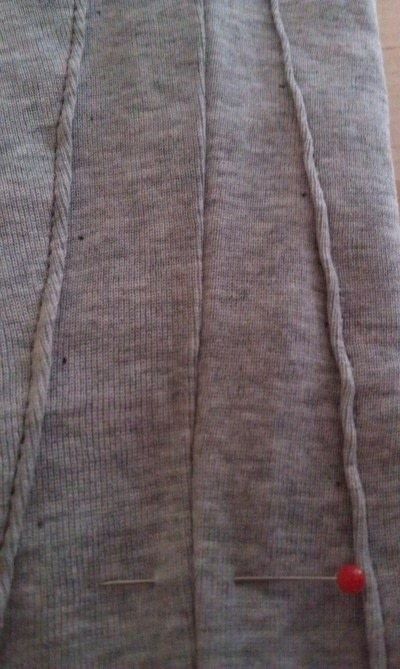
Identify the location of background, a tabletop. (387, 21).